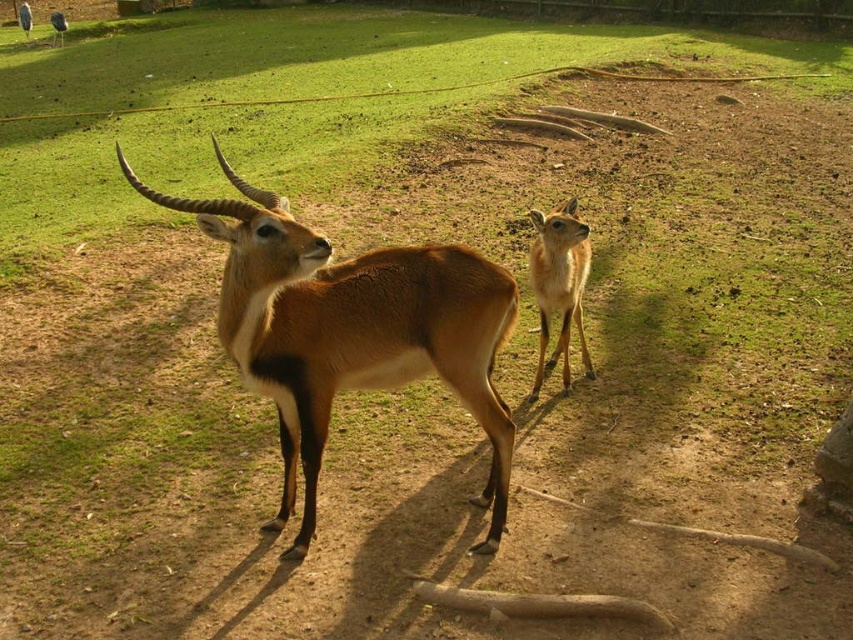
Between green grass at center and light brown fur at center, which one appears on the right side from the viewer's perspective?

light brown fur at center

What do you see at coordinates (289, 97) in the screenshot? This screenshot has height=640, width=853. I see `green grass at center` at bounding box center [289, 97].

Which is in front, point (215, 44) or point (549, 314)?

Point (549, 314) is more forward.

This screenshot has height=640, width=853. What are the coordinates of `green grass at center` in the screenshot? It's located at (289, 97).

Between brown glossy antelope at center and light brown fur at center, which one has more height?

brown glossy antelope at center

Who is more distant from viewer, (424, 355) or (566, 252)?

The point (566, 252) is behind.

You are a GUI agent. You are given a task and a screenshot of the screen. Output one action in this format:
    pyautogui.click(x=<x>, y=<y>)
    Task: Click on the brown glossy antelope at center
    Image resolution: width=853 pixels, height=640 pixels.
    Given the screenshot: What is the action you would take?
    pyautogui.click(x=351, y=330)

Which is behind, point (305, 124) or point (248, 310)?

The point (305, 124) is more distant.

Does green grass at center appear under brown glossy antelope at center?

No.

Where is `green grass at center`? This screenshot has height=640, width=853. green grass at center is located at coordinates (x=289, y=97).